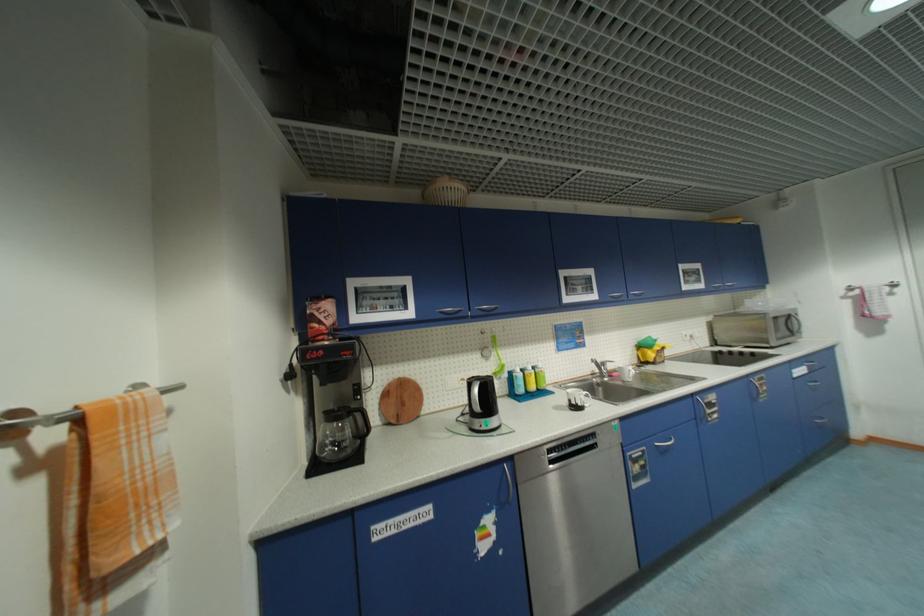
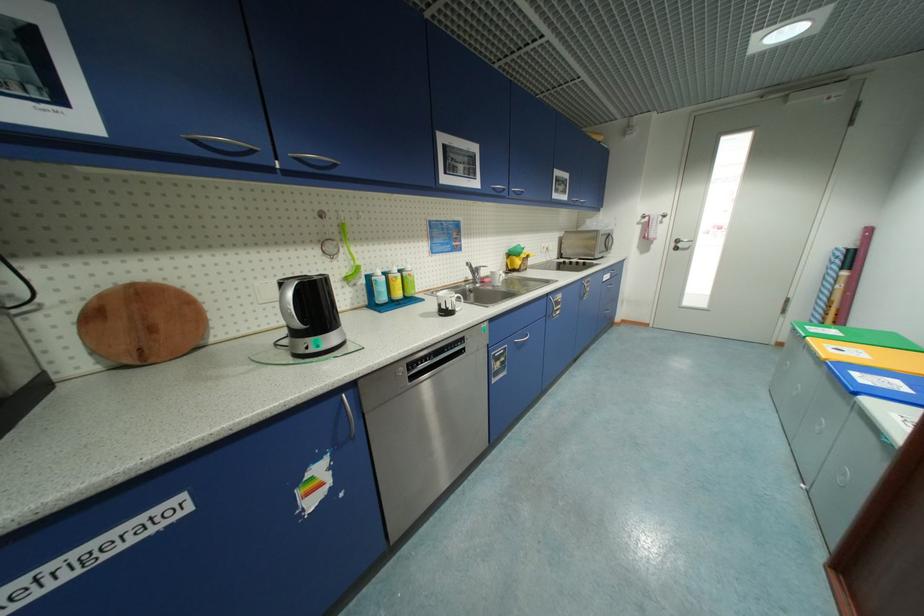
The point at (x=782, y=318) is marked in the first image. Where is the corresponding point in the second image?

(609, 236)